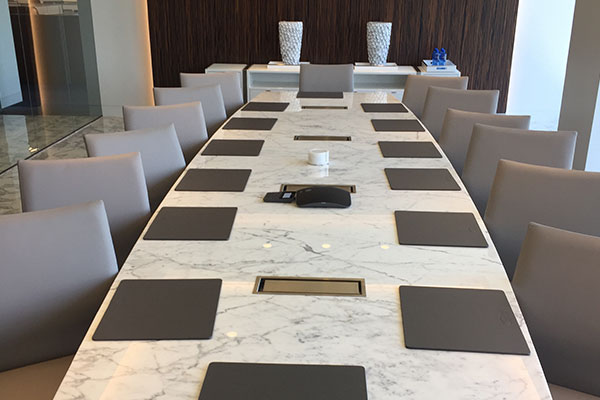
This screenshot has height=400, width=600. What are the coordinates of `white table` in the screenshot? It's located at (276, 71), (375, 75).